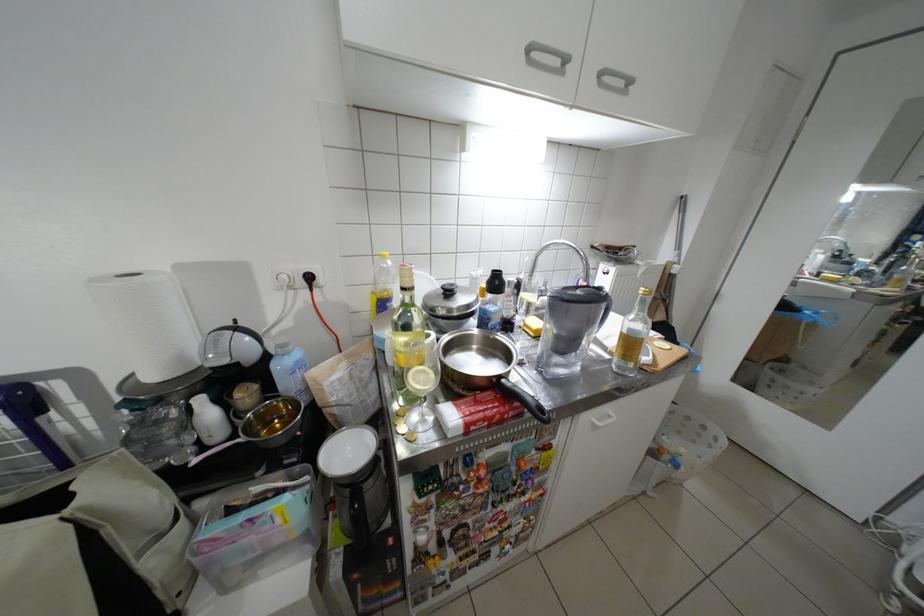
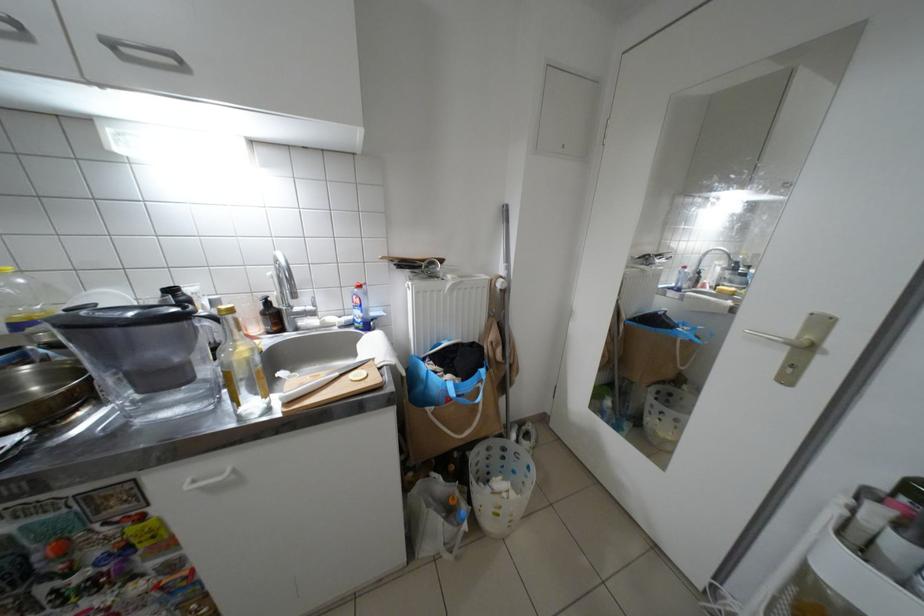
Locate, in the second image, the point that corresponds to point 665,482 in the first image.

(453, 541)